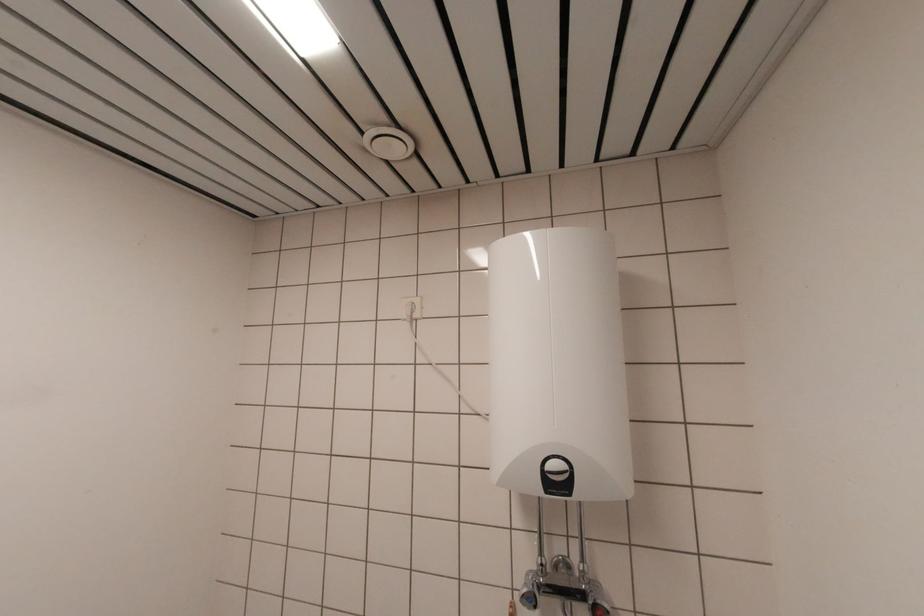
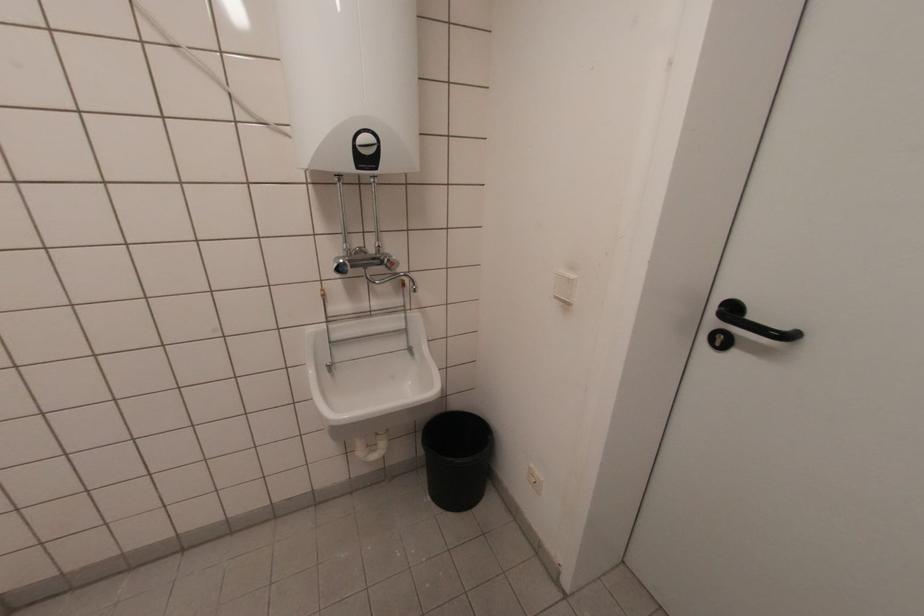
The images are taken continuously from a first-person perspective. In which direction is your viewpoint rotating?

The camera rotated toward right-down.